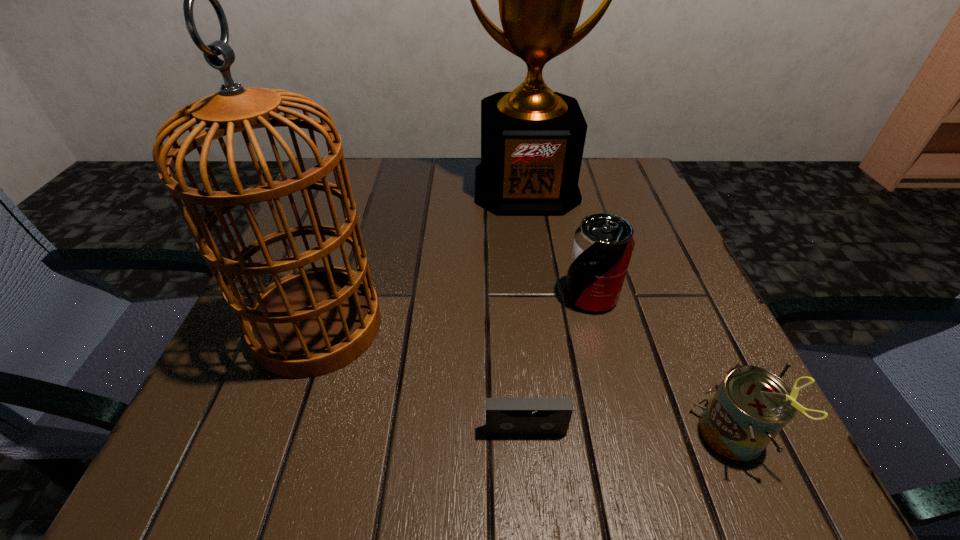
I want to click on object that is at the far edge, so click(532, 139).

At what (x,y) coordinates should I click in order to perform the action: click on can at the near edge. Please return your answer as a coordinate pair (x, y). Looking at the image, I should click on point(751,405).

I want to click on videotape at the near edge, so click(x=504, y=416).

Find the location of a particular element. This screenshot has height=540, width=960. object at the left edge is located at coordinates (312, 322).

Locate an element on the screen. trophy cup at the right edge is located at coordinates (532, 139).

I want to click on soda can present at the right edge, so click(602, 247).

You are a GUI agent. You are given a task and a screenshot of the screen. Output one action in this format:
    pyautogui.click(x=<x>, y=<y>)
    Task: Click on the can that is positioned at the right edge
    The height and width of the screenshot is (540, 960).
    Given the screenshot: What is the action you would take?
    pyautogui.click(x=751, y=405)

You are a GUI agent. You are given a task and a screenshot of the screen. Output one action in this format:
    pyautogui.click(x=<x>, y=<y>)
    Task: Click on the object that is at the far right corner
    The image size is (960, 540).
    Given the screenshot: What is the action you would take?
    pyautogui.click(x=532, y=139)

Locate an element on the screen. object that is at the near right corner is located at coordinates (751, 405).

This screenshot has width=960, height=540. I want to click on vacant space at the far edge of the desktop, so click(467, 158).